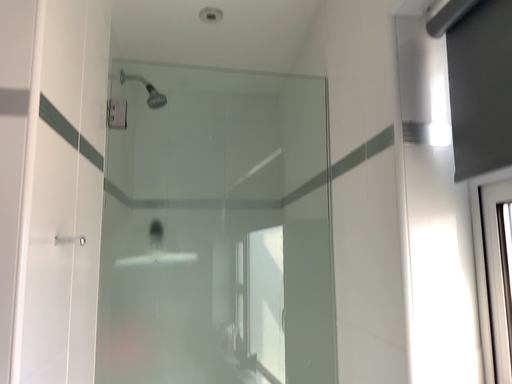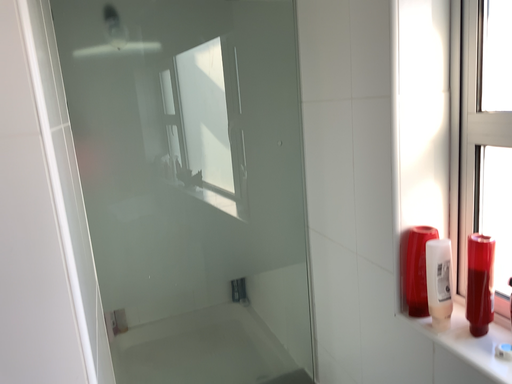
Question: Which way did the camera rotate in the video?

Choices:
 (A) rotated right
 (B) rotated left

Answer: (A)